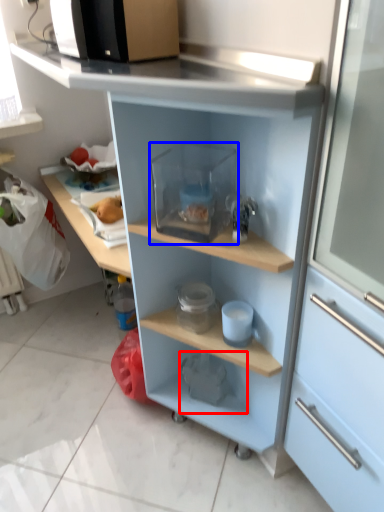
Question: Which object is further to the camera taking this photo, appliance (highlighted by a red box) or appliance (highlighted by a blue box)?

Choices:
 (A) appliance
 (B) appliance

Answer: (A)